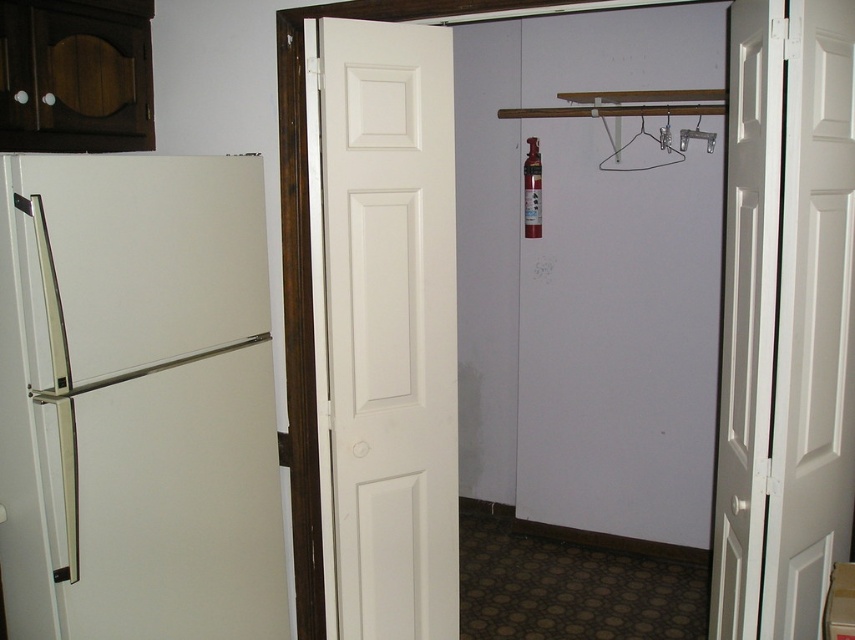
Question: Is white matte door at center wider than white wooden door at center?

Choices:
 (A) no
 (B) yes

Answer: (B)

Question: Which is farther from the white wooden door at center?

Choices:
 (A) white smooth door at center
 (B) metallic silver hanger at upper center

Answer: (B)

Question: Does white matte door at center have a smaller size compared to metallic silver hanger at upper center?

Choices:
 (A) yes
 (B) no

Answer: (B)

Question: Which point is closer to the camera taking this photo?

Choices:
 (A) (62, 612)
 (B) (394, 108)
 (C) (818, 378)
 (D) (711, 628)

Answer: (A)

Question: Can you confirm if white smooth door at center is bigger than white wooden door at center?

Choices:
 (A) yes
 (B) no

Answer: (B)

Question: Based on their relative distances, which object is nearer to the white wooden door at center?

Choices:
 (A) white matte refrigerator at left
 (B) white matte door at center
 (C) metallic silver hanger at upper center
 (D) white smooth door at center

Answer: (D)